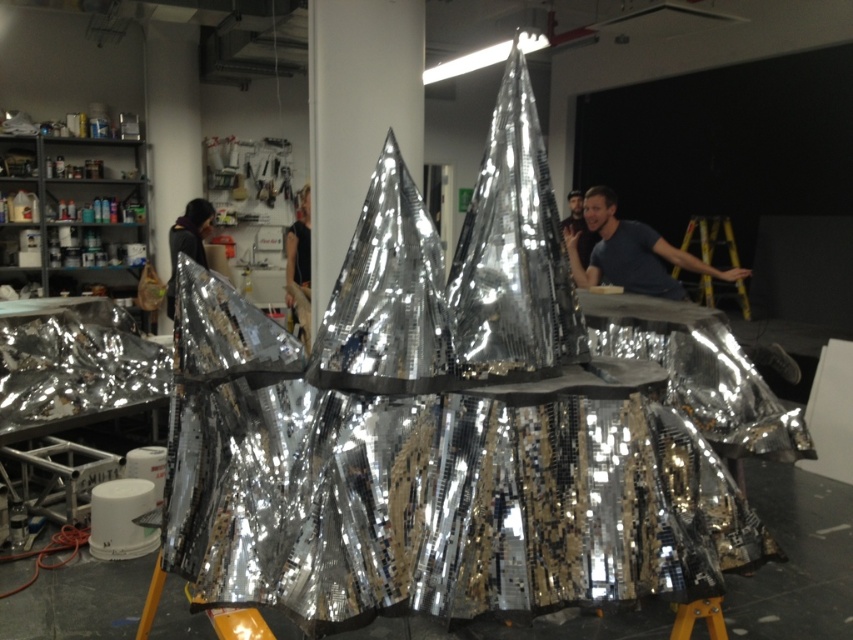
Question: Can you confirm if matte blue shirt at upper right is positioned to the right of dark brown leather jacket at center?

Choices:
 (A) no
 (B) yes

Answer: (B)

Question: Does matte blue shirt at upper right lie in front of dark brown leather jacket at center?

Choices:
 (A) no
 (B) yes

Answer: (B)

Question: Which point appears farthest from the camera in this image?

Choices:
 (A) (288, 285)
 (B) (666, 256)
 (C) (196, 259)

Answer: (A)

Question: Is matte blue shirt at upper right smaller than metallic silver jacket at center?

Choices:
 (A) no
 (B) yes

Answer: (B)

Question: Which object appears farthest from the camera in this image?

Choices:
 (A) dark brown leather jacket at center
 (B) matte blue shirt at upper right
 (C) metallic silver jacket at center

Answer: (C)

Question: Which of the following is the closest to the observer?

Choices:
 (A) (305, 196)
 (B) (619, 257)

Answer: (B)